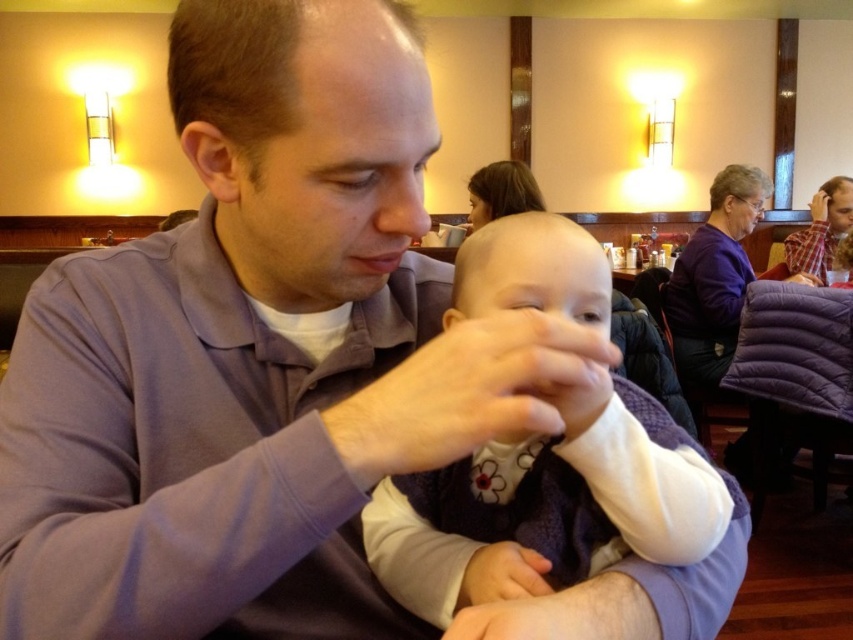
You are a photographer setting up for a family photo shoot. You need to position a white soft fabric baby at center and a plaid shirt at right in the frame. Based on the scene description, which object is shorter?

The white soft fabric baby at center is shorter than the plaid shirt at right.

You are a photographer positioned at the back of the room. You want to take a photo of the white soft fabric baby at center without the plaid shirt at right blocking the view. Is the baby currently visible in your frame?

The white soft fabric baby at center is in front of the plaid shirt at right, so yes, the baby is visible and not blocked by the plaid shirt at right.

You are a photographer positioned at the entrance of the restaurant. You want to take a photo of the white soft fabric baby at center without moving any objects. Based on the baby being at point 0.784, 0.646, will the baby be in the center of your photo if your camera has a standard 50mm lens and you are standing directly facing the scene?

The white soft fabric baby at center is located at point (550, 500), which means it is slightly offset from the exact center of the frame. Therefore, the baby will not be perfectly centered in the photo.